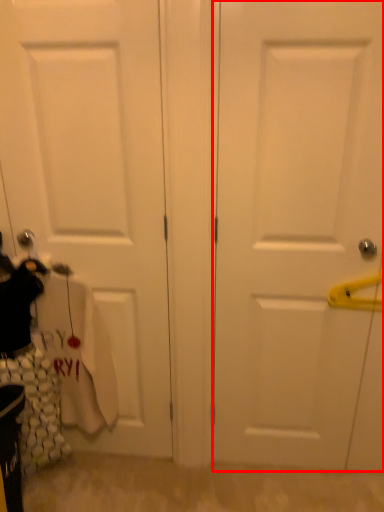
Question: From the image's perspective, what is the correct spatial positioning of door (annotated by the red box) in reference to door?

Choices:
 (A) below
 (B) above

Answer: (A)